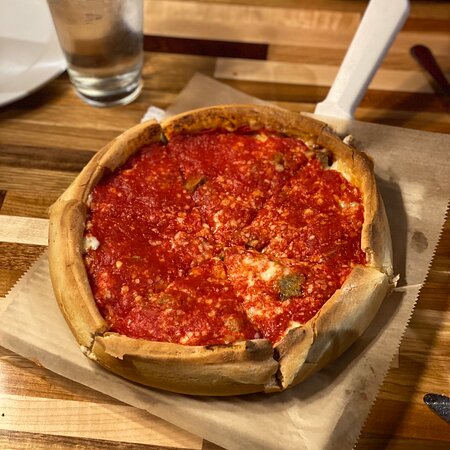
You are a GUI agent. You are given a task and a screenshot of the screen. Output one action in this format:
    pyautogui.click(x=<x>, y=<y>)
    Task: Click on the handle
    Image resolution: width=450 pixels, height=450 pixels.
    Given the screenshot: What is the action you would take?
    pyautogui.click(x=354, y=73)